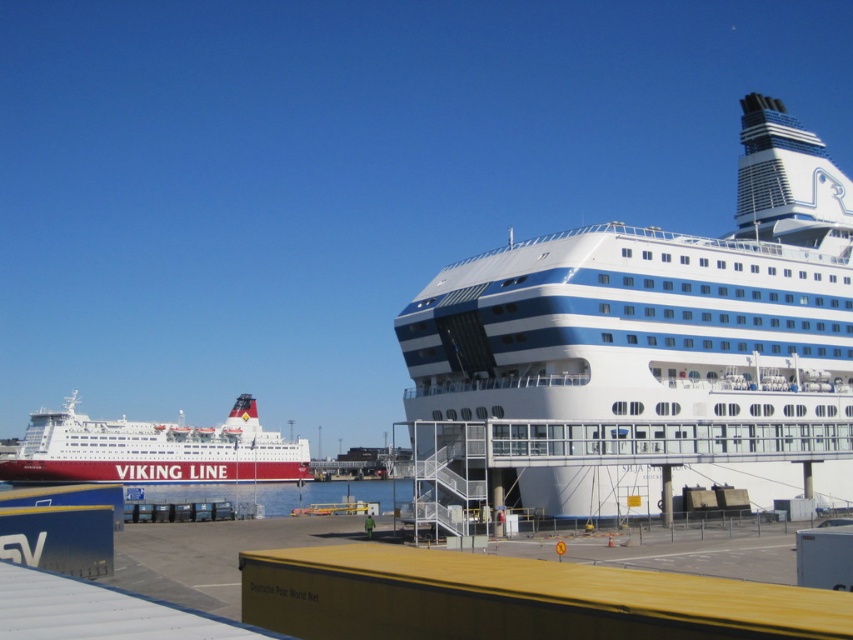
Is white glossy cruise ship at right taller than white glossy ferry at left?

Yes, white glossy cruise ship at right is taller than white glossy ferry at left.

Does point (460, 310) come behind point (229, 445)?

No.

You are a GUI agent. You are given a task and a screenshot of the screen. Output one action in this format:
    pyautogui.click(x=<x>, y=<y>)
    Task: Click on the white glossy cruise ship at right
    
    Given the screenshot: What is the action you would take?
    pyautogui.click(x=643, y=352)

Where is `white glossy cruise ship at right`? This screenshot has width=853, height=640. white glossy cruise ship at right is located at coordinates (643, 352).